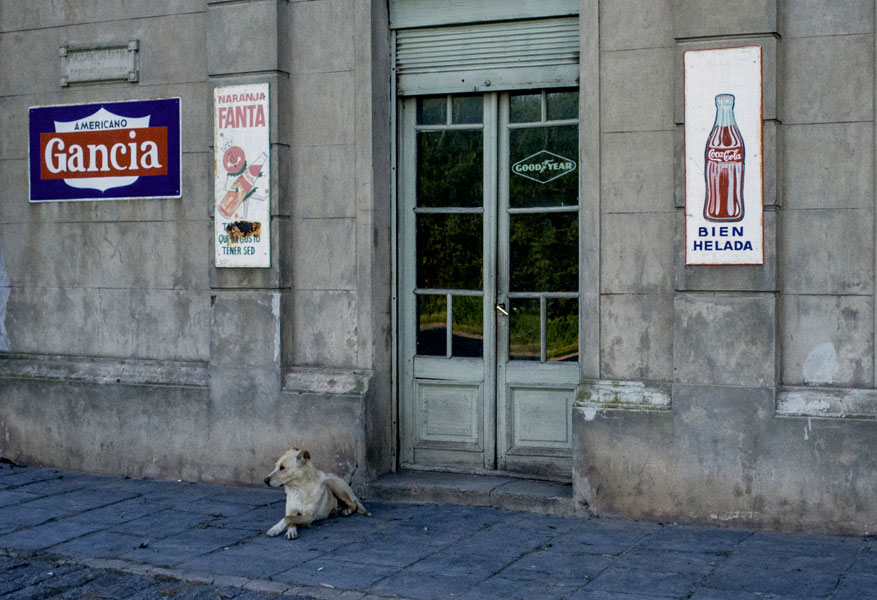
Where is `door handle`? Image resolution: width=877 pixels, height=600 pixels. door handle is located at coordinates (503, 310).